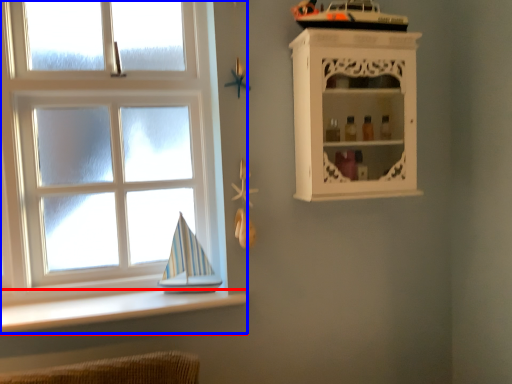
Question: Which object is further to the camera taking this photo, ledge (highlighted by a red box) or window (highlighted by a blue box)?

Choices:
 (A) ledge
 (B) window

Answer: (B)